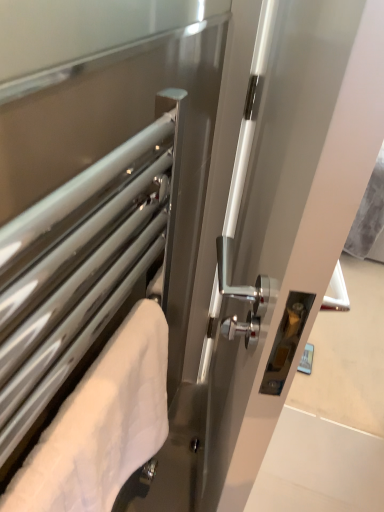
Question: From a real-world perspective, is white fluffy towel at left physically located above or below satin silver towel rack at left, positioned as the second screen door in right-to-left order?

Choices:
 (A) below
 (B) above

Answer: (A)

Question: Based on their positions, is white fluffy towel at left located to the left or right of satin silver towel rack at left, positioned as the second screen door in right-to-left order?

Choices:
 (A) right
 (B) left

Answer: (A)

Question: Which is farther from the white fluffy towel at left?

Choices:
 (A) satin silver towel rack at left, the 1th screen door in the left-to-right sequence
 (B) white glossy handle at center, the 2th screen door positioned from the left

Answer: (B)

Question: Estimate the real-world distances between objects in this image. Which object is closer to the white glossy handle at center, which is the 1th screen door in right-to-left order?

Choices:
 (A) satin silver towel rack at left, positioned as the second screen door in right-to-left order
 (B) white fluffy towel at left

Answer: (A)